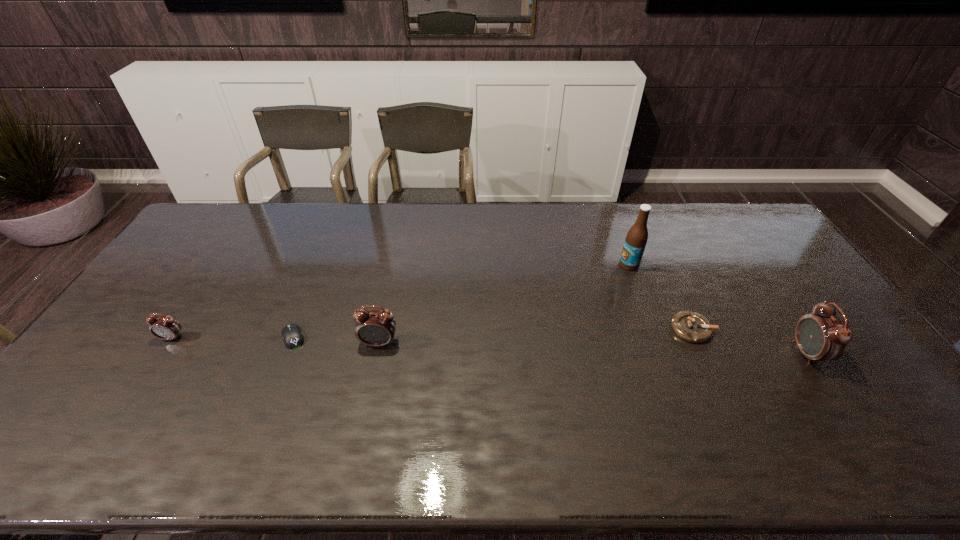
Where is `vacant position at the near edge of the desktop`? vacant position at the near edge of the desktop is located at coordinates (493, 388).

Locate an element on the screen. The width and height of the screenshot is (960, 540). free spot at the left edge of the desktop is located at coordinates (148, 350).

This screenshot has height=540, width=960. I want to click on vacant space at the far right corner of the desktop, so click(x=745, y=218).

This screenshot has width=960, height=540. What are the coordinates of `blank region between the fourth tallest object and the fourth shortest object` in the screenshot? It's located at (276, 340).

Locate an element on the screen. unoccupied area between the farthest object and the third object from left to right is located at coordinates (504, 304).

Identify the location of free area in between the beer bottle and the fifth object from left to right. The width and height of the screenshot is (960, 540). (660, 297).

Locate an element on the screen. This screenshot has height=540, width=960. vacant area between the rightmost alarm clock and the tallest object is located at coordinates (718, 309).

Where is `blank region between the fifth object from left to right and the second shortest alarm clock`? blank region between the fifth object from left to right and the second shortest alarm clock is located at coordinates (536, 336).

What are the coordinates of `free space that is in between the rightmost alarm clock and the tallest object` in the screenshot? It's located at (718, 309).

What are the coordinates of `free spot between the fifth object from left to right and the leftmost alarm clock` in the screenshot? It's located at (432, 333).